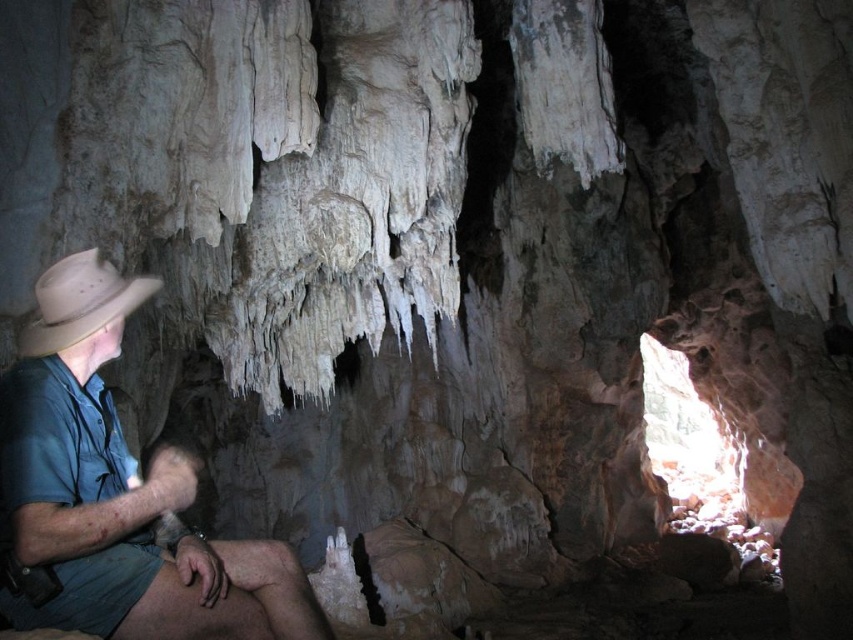
Between light brown leather hat at left and beige felt fedora at left, which one appears on the left side from the viewer's perspective?

beige felt fedora at left is more to the left.

Measure the distance between light brown leather hat at left and beige felt fedora at left.

10.61 inches

The image size is (853, 640). What do you see at coordinates (119, 492) in the screenshot?
I see `light brown leather hat at left` at bounding box center [119, 492].

Where is `light brown leather hat at left`? The height and width of the screenshot is (640, 853). light brown leather hat at left is located at coordinates (119, 492).